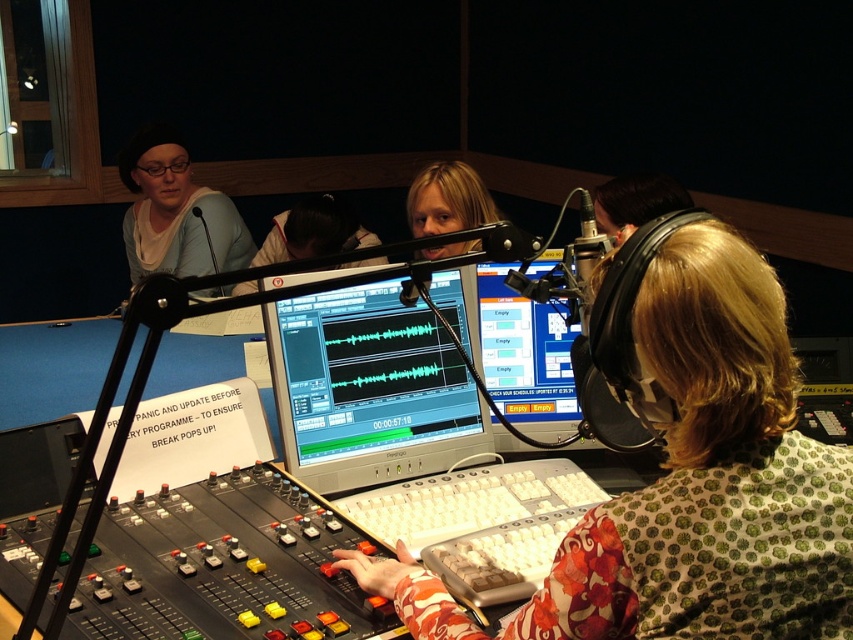
Is floral fabric shirt at center positioned before matte black headphones at upper right?

Yes, floral fabric shirt at center is closer to the viewer.

Can you confirm if floral fabric shirt at center is positioned to the right of matte black headphones at upper right?

Incorrect, floral fabric shirt at center is not on the right side of matte black headphones at upper right.

Is point (614, 508) positioned in front of point (666, 208)?

Yes, it is.

The height and width of the screenshot is (640, 853). I want to click on floral fabric shirt at center, so click(x=711, y=476).

Is matte black monitor at center to the left of matte black headphones at upper right from the viewer's perspective?

Correct, you'll find matte black monitor at center to the left of matte black headphones at upper right.

Does point (552, 403) come farther from viewer compared to point (631, 204)?

No, (552, 403) is closer to viewer.

The height and width of the screenshot is (640, 853). Identify the location of matte black monitor at center. (526, 356).

This screenshot has height=640, width=853. I want to click on matte black monitor at center, so click(x=526, y=356).

Between matte black shirt at upper left and smooth black hair at center, which one appears on the left side from the viewer's perspective?

From the viewer's perspective, matte black shirt at upper left appears more on the left side.

Does matte black shirt at upper left appear on the left side of smooth black hair at center?

Yes, matte black shirt at upper left is to the left of smooth black hair at center.

I want to click on matte black shirt at upper left, so [x=177, y=212].

Where is `matte black shirt at upper left`? matte black shirt at upper left is located at coordinates (177, 212).